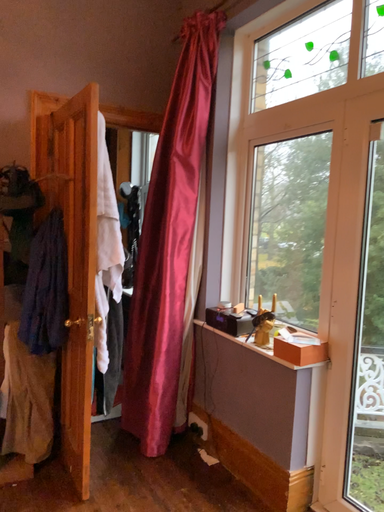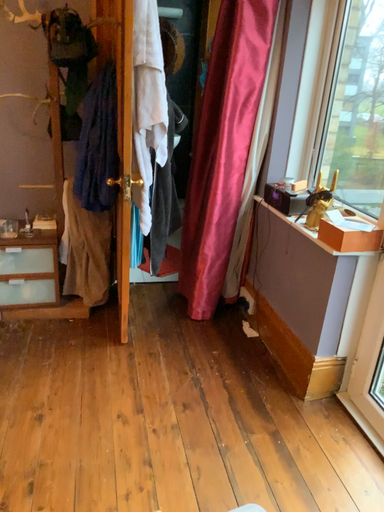
Question: How did the camera likely rotate when shooting the video?

Choices:
 (A) rotated right
 (B) rotated left

Answer: (B)